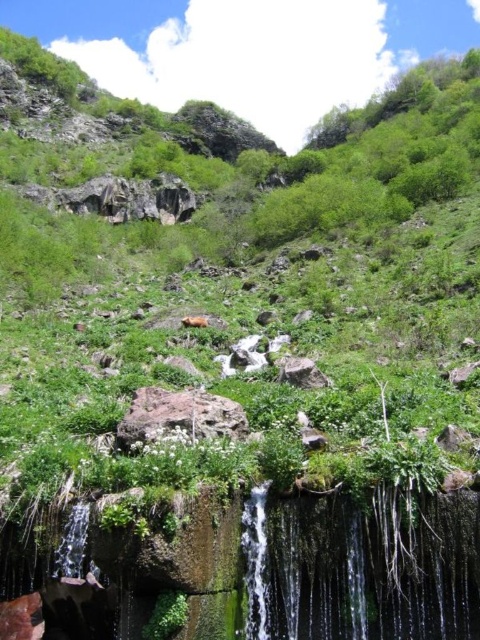
You are standing at the edge of the waterfall and want to place a small decorative rock. You have two points marked in the scene, point A at coordinates point (308,618) and point B at coordinates point (211,432). Which point is closer to you where you can place the rock more visibly?

Point point (308,618) is closer to the viewer than point point (211,432), so placing the rock there would make it more visible.

You are standing at the base of the waterfall in the image. There is a clear water at center marked by point (358, 572). If you want to reach the clear water at center, which direction should you move relative to your current position?

The clear water at center is located at point (358, 572), so you should move towards the center of the scene to reach it.

You are planning to cross the clear water at center and the rusty rock at center in the image. Which path is narrower?

The clear water at center is narrower than the rusty rock at center because its width is less than the rusty rock at center.